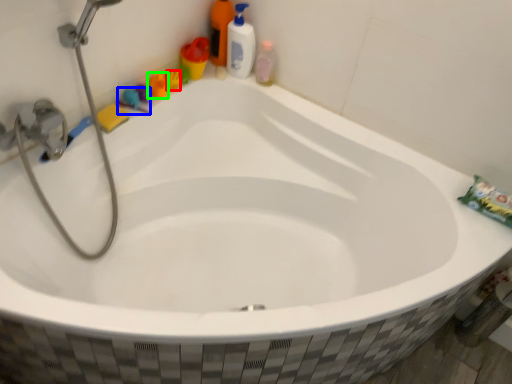
Question: Which is farther away from toy (highlighted by a red box)? toy (highlighted by a blue box) or toy (highlighted by a green box)?

Choices:
 (A) toy
 (B) toy

Answer: (A)